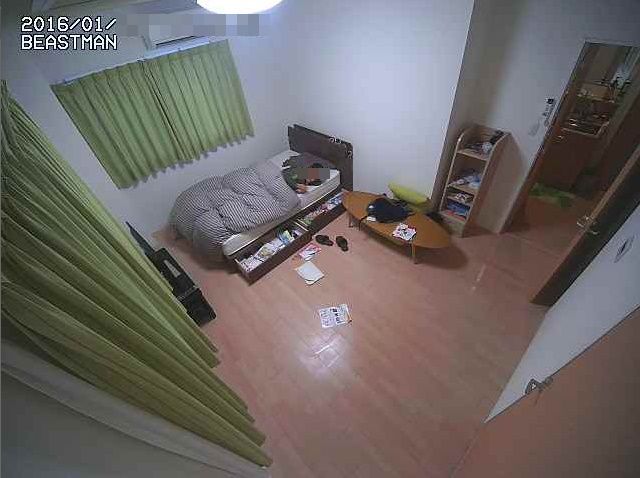
Find the location of a particular element. brown door is located at coordinates pyautogui.click(x=603, y=218).